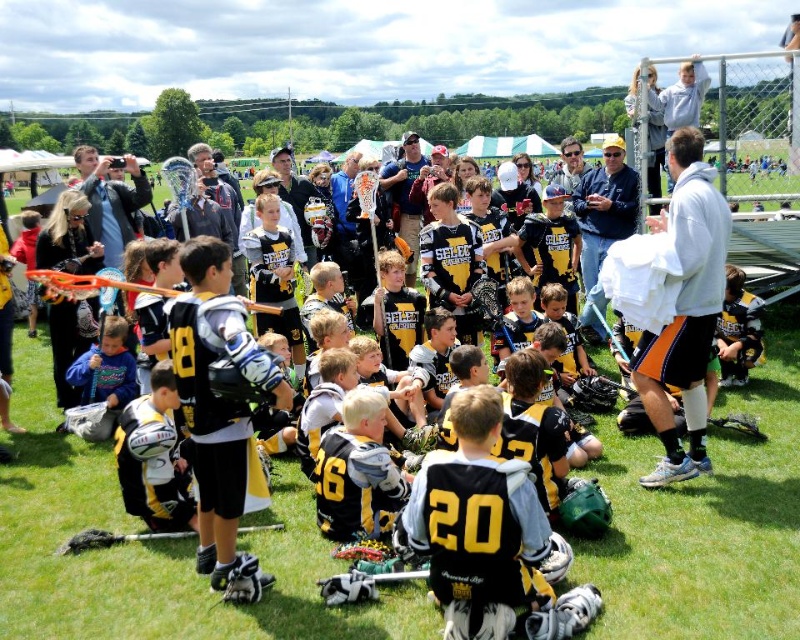
Which of these two, black/yellow jersey at center or black matte jersey at center, stands shorter?

black/yellow jersey at center

Does black/yellow jersey at center have a lesser width compared to black matte jersey at center?

Correct, black/yellow jersey at center's width is less than black matte jersey at center's.

Which is in front, point (680, 577) or point (478, 586)?

Point (478, 586) is more forward.

The height and width of the screenshot is (640, 800). Find the location of `black/yellow jersey at center`. black/yellow jersey at center is located at coordinates (158, 554).